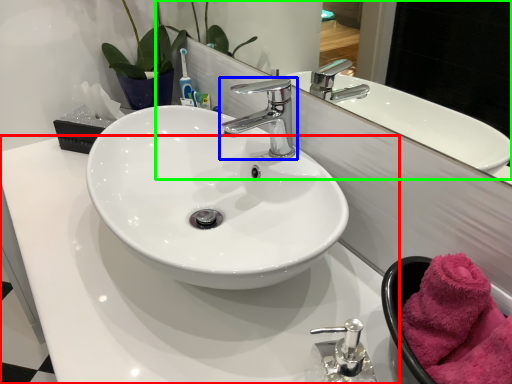
Question: Considering the real-world distances, which object is closest to counter top (highlighted by a red box)? tap (highlighted by a blue box) or mirror (highlighted by a green box).

Choices:
 (A) tap
 (B) mirror

Answer: (A)